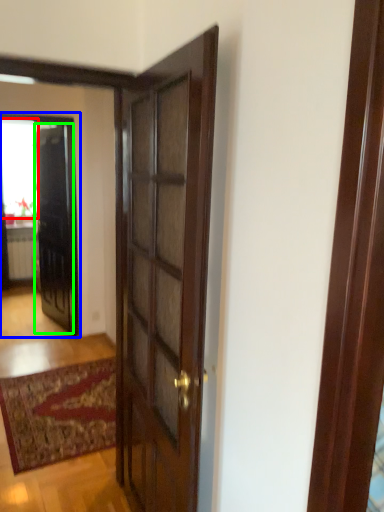
Question: Which object is positioned closest to window (highlighted by a red box)? Select from elevator (highlighted by a blue box) and door (highlighted by a green box).

Choices:
 (A) elevator
 (B) door

Answer: (B)